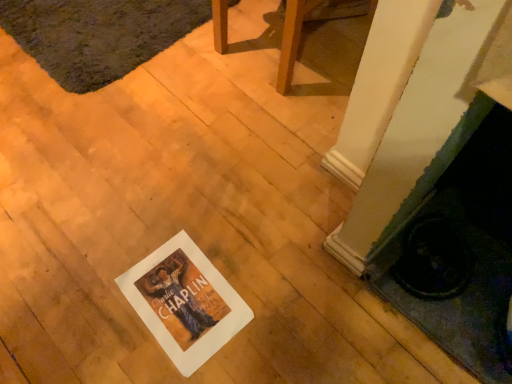
Question: In terms of width, does white paper at center look wider or thinner when compared to wooden chair at center?

Choices:
 (A) wide
 (B) thin

Answer: (B)

Question: Relative to wooden chair at center, is white paper at center in front or behind?

Choices:
 (A) front
 (B) behind

Answer: (A)

Question: Which is nearer to the wooden chair at center?

Choices:
 (A) white paper at center
 (B) dark gray shaggy rug at upper left

Answer: (B)

Question: Which object is the farthest from the white paper at center?

Choices:
 (A) dark gray shaggy rug at upper left
 (B) wooden chair at center

Answer: (A)